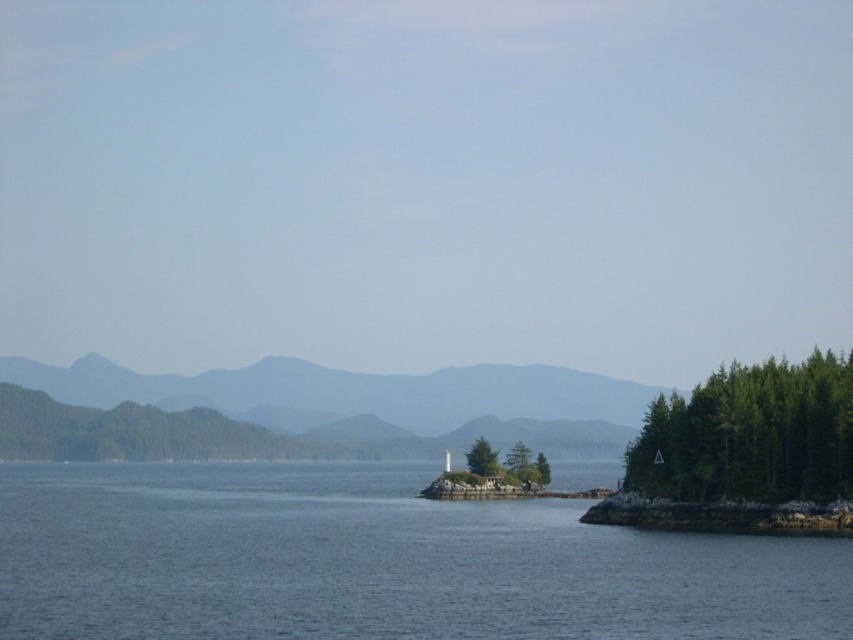
You are a hiker standing on the coast looking at the gray textured mountain at center and the green matte tree at center. Which object appears larger in the scene?

The gray textured mountain at center appears larger than the green matte tree at center in the scene.

You are an environmental scientist assessing the coastal area. You notice two types of trees in the scene. The green textured trees at right and the green matte tree at center. Which group of trees has a wider spread in terms of horizontal coverage?

The green textured trees at right have a wider spread in terms of horizontal coverage as their width is larger than the green matte tree at center.

You are a hiker planning to take a photo of the gray textured mountain at center and the green matte tree at center from a viewpoint. Which object should you position closer to the edge of your photo frame to ensure both fit in the shot?

The gray textured mountain at center might be wider than the green matte tree at center, so you should position the gray textured mountain at center closer to the edge of your photo frame to ensure both fit in the shot.